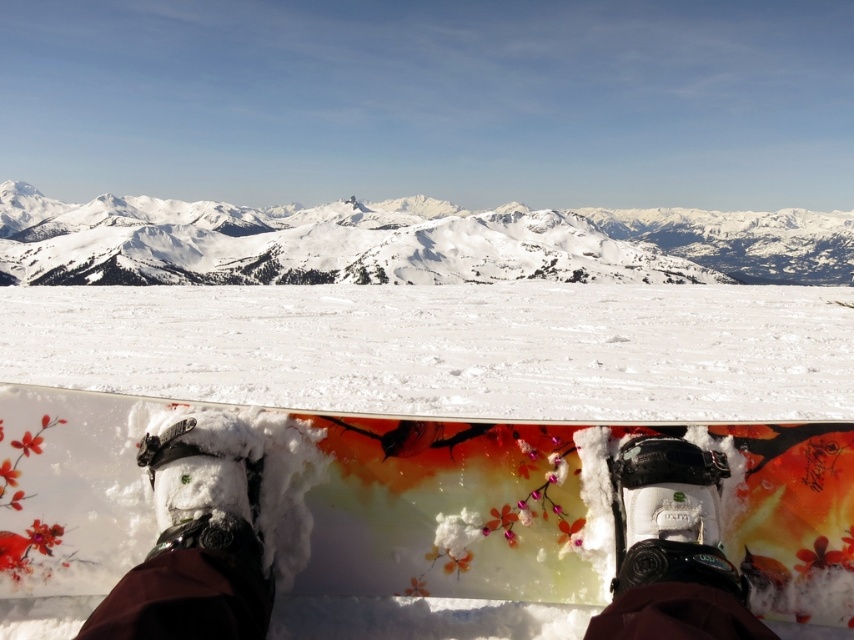
Which is in front, point (834, 340) or point (141, 220)?

Point (834, 340)

Can you confirm if white glossy snow at center is wider than snowy white mountain at upper center?

No, white glossy snow at center is not wider than snowy white mountain at upper center.

Does point (25, 372) lie behind point (664, 273)?

No, it is in front of (664, 273).

What are the coordinates of `white glossy snow at center` in the screenshot? It's located at (449, 348).

Does point (98, 404) lie behind point (700, 538)?

Yes, it is behind point (700, 538).

Is floral painted wood snowboard at center below matte black boot at lower center?

No.

Find the location of a particular element. This screenshot has height=640, width=854. floral painted wood snowboard at center is located at coordinates (452, 509).

Is snowy white mountain at upper center shorter than matte black boot at lower center?

No.

Between snowy white mountain at upper center and matte black boot at lower center, which one is positioned lower?

matte black boot at lower center

Between point (106, 232) and point (636, 465), which one is positioned behind?

Point (106, 232)

Find the location of `snowy white mountain at upper center`. snowy white mountain at upper center is located at coordinates (407, 243).